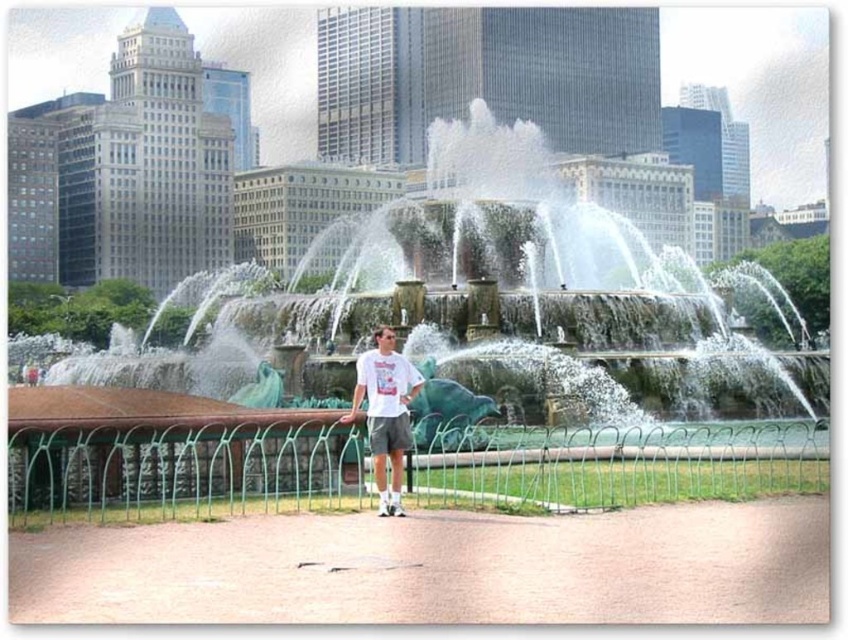
Question: Which point appears farthest from the camera in this image?

Choices:
 (A) (406, 397)
 (B) (643, 264)

Answer: (B)

Question: Is green patina water at center bigger than white cotton t-shirt at center?

Choices:
 (A) yes
 (B) no

Answer: (A)

Question: Does green patina water at center appear over white cotton t-shirt at center?

Choices:
 (A) yes
 (B) no

Answer: (A)

Question: Is green patina water at center bigger than white cotton t-shirt at center?

Choices:
 (A) yes
 (B) no

Answer: (A)

Question: Which point is farther to the camera?

Choices:
 (A) (587, 400)
 (B) (399, 396)

Answer: (A)

Question: Which of the following is the farthest from the observer?

Choices:
 (A) white cotton t-shirt at center
 (B) green patina water at center

Answer: (B)